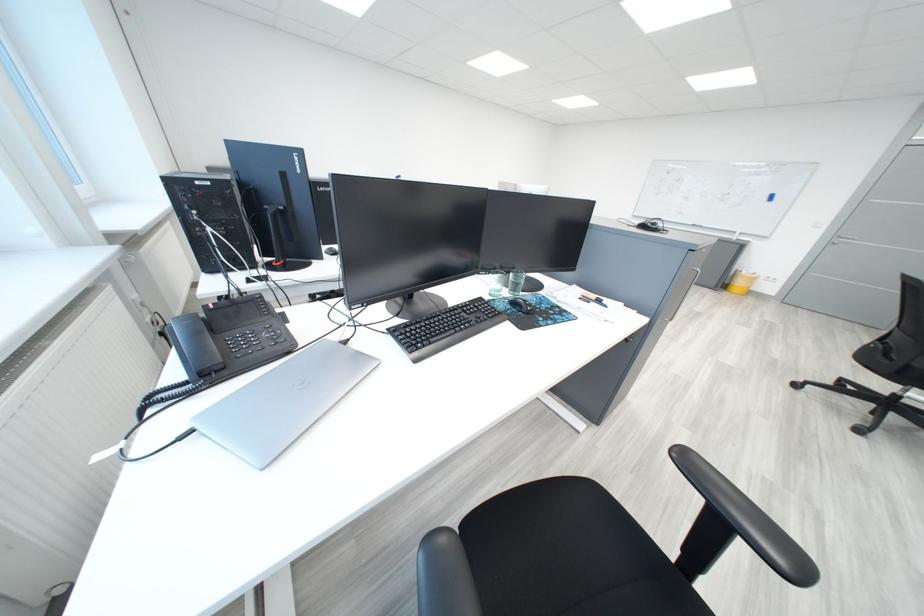
Image resolution: width=924 pixels, height=616 pixels. What do you see at coordinates (771, 197) in the screenshot?
I see `a blue whiteboard eraser` at bounding box center [771, 197].